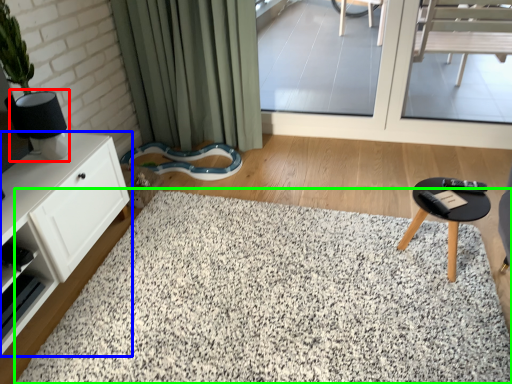
Question: Which object is positioned closest to lamp (highlighted by a red box)? Select from cabinetry (highlighted by a blue box) and mat (highlighted by a green box).

Choices:
 (A) cabinetry
 (B) mat

Answer: (A)